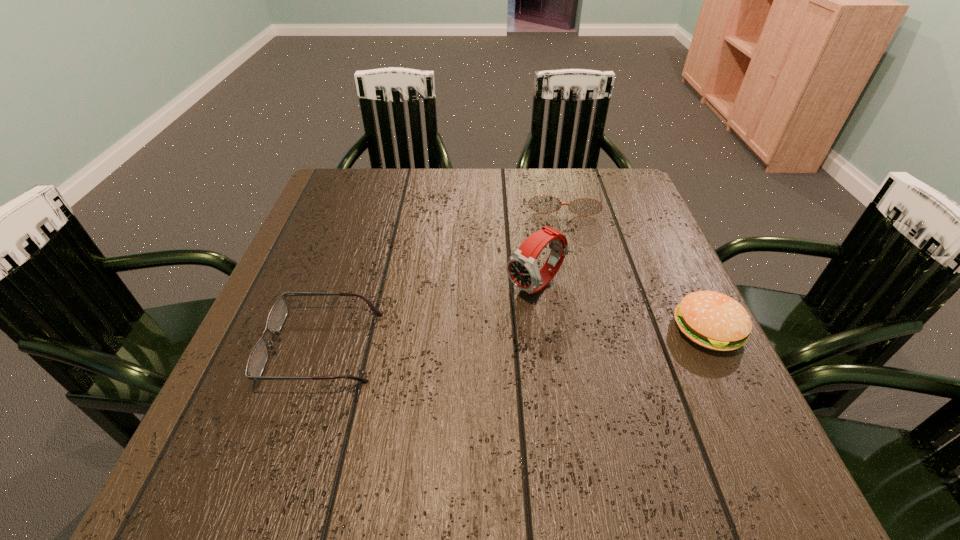
This screenshot has height=540, width=960. Find the location of `vacant region between the watch and the patty`. vacant region between the watch and the patty is located at coordinates (622, 308).

The width and height of the screenshot is (960, 540). I want to click on free space between the patty and the watch, so click(x=622, y=308).

Identify which object is the third closest to the rightmost object. Please provide its 2D coordinates. Your answer should be formatted as a tuple, i.e. [(x, y)], where the tuple contains the x and y coordinates of a point satisfying the conditions above.

[(259, 355)]

Locate an element on the screen. Image resolution: width=960 pixels, height=540 pixels. the third closest object relative to the tallest object is located at coordinates (259, 355).

Where is `vacant area in the image that satisfies the following two spatial constraints: 1. on the front side of the patty; 2. on the right side of the tallest object`? Image resolution: width=960 pixels, height=540 pixels. vacant area in the image that satisfies the following two spatial constraints: 1. on the front side of the patty; 2. on the right side of the tallest object is located at coordinates (542, 329).